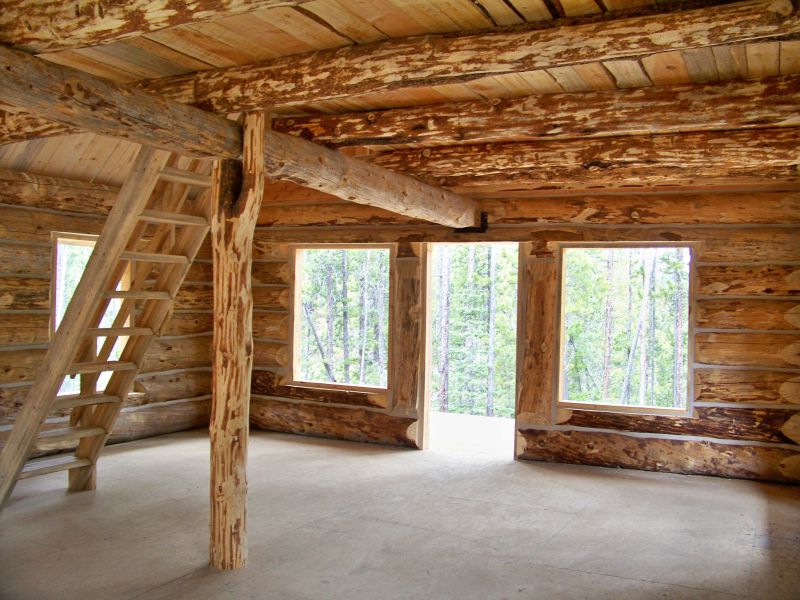
Find the location of `handrail`. handrail is located at coordinates (154, 241), (101, 312).